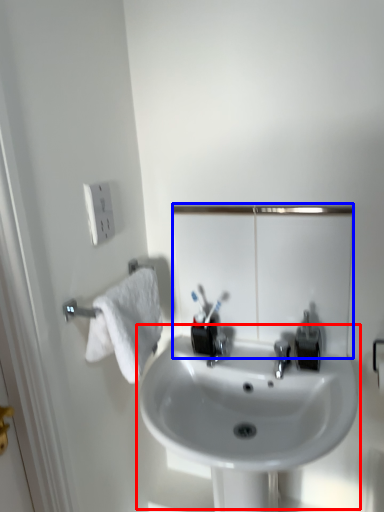
Question: Which object is closer to the camera taking this photo, sink (highlighted by a red box) or mirror (highlighted by a blue box)?

Choices:
 (A) sink
 (B) mirror

Answer: (A)